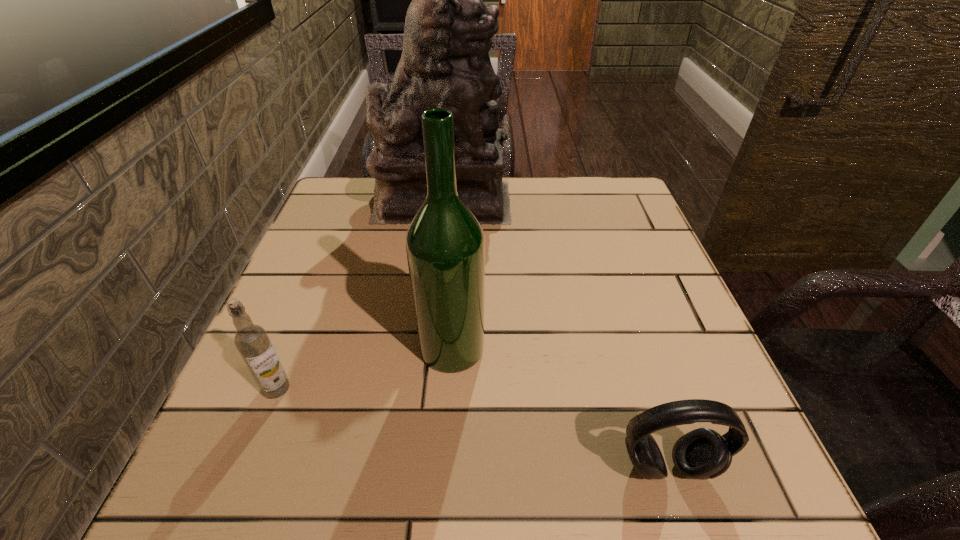
Locate an element on the screen. The image size is (960, 540). free space between the sculpture and the headset is located at coordinates (555, 334).

The width and height of the screenshot is (960, 540). Find the location of `unoccupied area between the shortest object and the sculpture`. unoccupied area between the shortest object and the sculpture is located at coordinates (555, 334).

The width and height of the screenshot is (960, 540). Identify the location of free space between the alcohol and the vodka. (364, 368).

Locate an element on the screen. free space between the leftmost object and the alcohol is located at coordinates (364, 368).

Choose which object is the nearest neighbor to the rightmost object. Please provide its 2D coordinates. Your answer should be formatted as a tuple, i.e. [(x, y)], where the tuple contains the x and y coordinates of a point satisfying the conditions above.

[(445, 245)]

I want to click on the third closest object to the sculpture, so click(703, 453).

Locate an element on the screen. The width and height of the screenshot is (960, 540). free region that satisfies the following two spatial constraints: 1. on the front-facing side of the sculpture; 2. on the label of the leftmost object is located at coordinates (421, 389).

Find the location of a particular element. vacant area that satisfies the following two spatial constraints: 1. on the front-facing side of the sculpture; 2. on the right side of the alcohol is located at coordinates (426, 348).

The width and height of the screenshot is (960, 540). Find the location of `free space that satisfies the following two spatial constraints: 1. on the front-facing side of the farthest object; 2. on the right side of the third nearest object`. free space that satisfies the following two spatial constraints: 1. on the front-facing side of the farthest object; 2. on the right side of the third nearest object is located at coordinates (426, 348).

The width and height of the screenshot is (960, 540). Identify the location of free location that satisfies the following two spatial constraints: 1. on the front-facing side of the sculpture; 2. on the left side of the third nearest object. (426, 348).